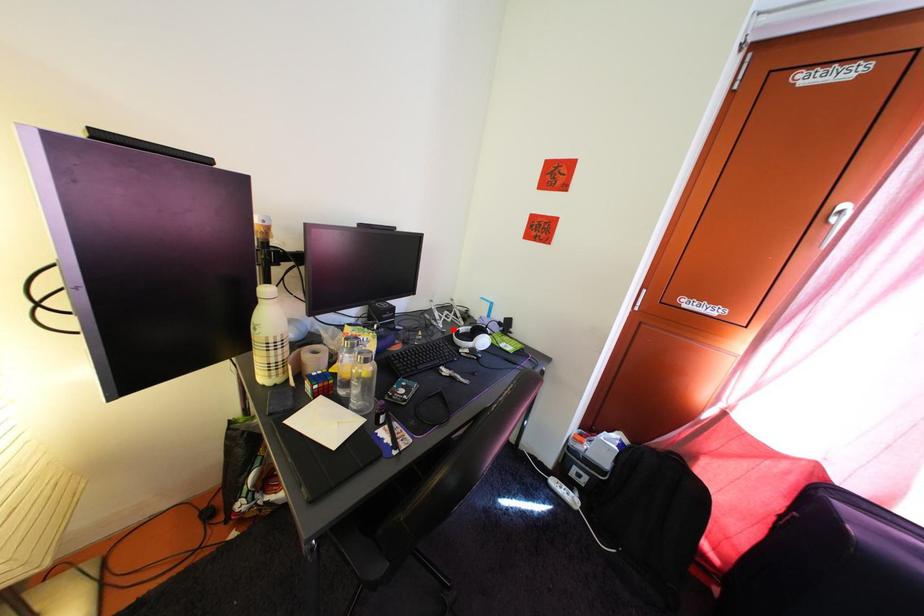
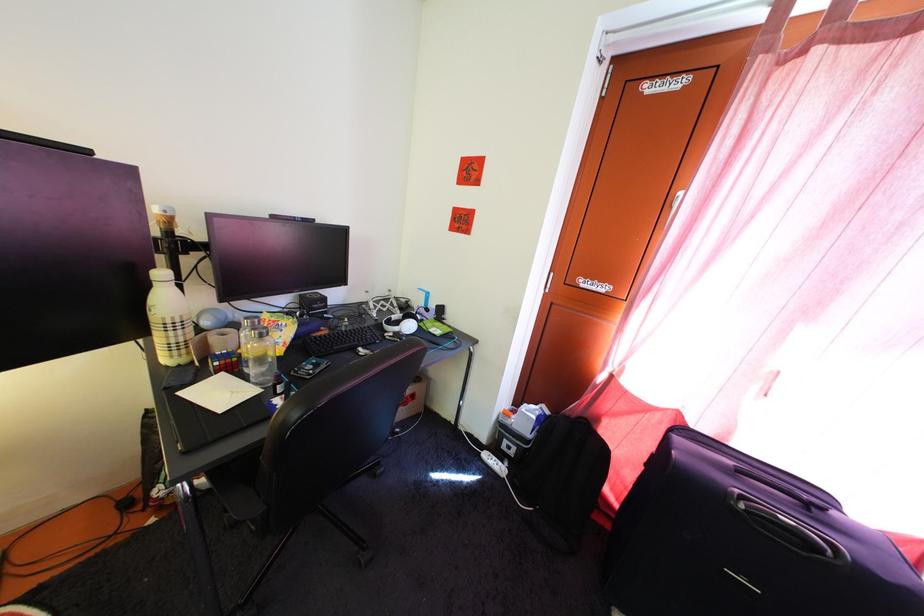
Locate, in the second image, the point that corresponds to the highlighted location in the first image.

(388, 318)